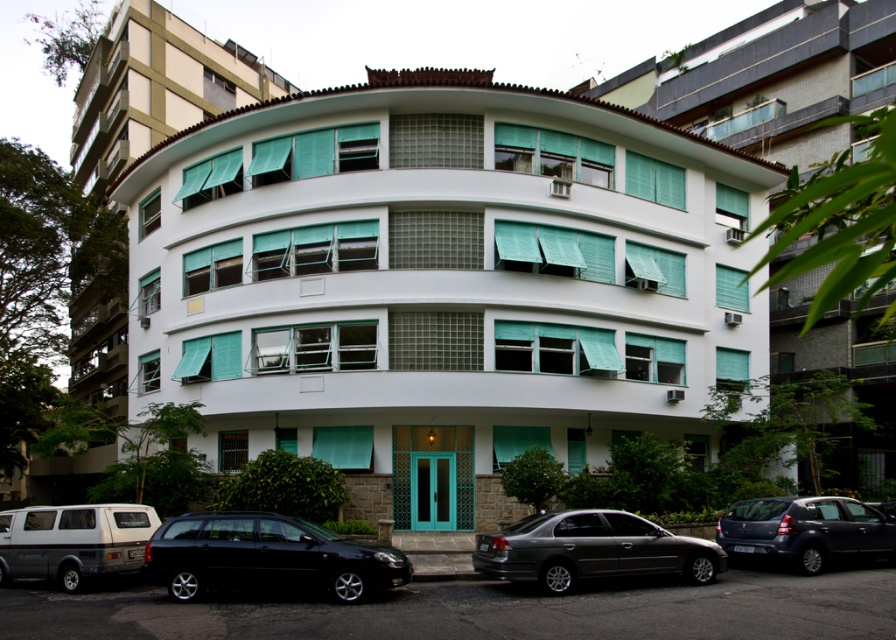
Question: Does white matte van at lower left have a smaller size compared to dark gray metallic car at lower right?

Choices:
 (A) no
 (B) yes

Answer: (B)

Question: Does black matte station wagon at lower left have a lesser width compared to metallic gray sedan at center?

Choices:
 (A) yes
 (B) no

Answer: (A)

Question: Among these objects, which one is farthest from the camera?

Choices:
 (A) white matte van at lower left
 (B) metallic gray sedan at center

Answer: (A)

Question: Among these points, which one is farthest from the camera?

Choices:
 (A) (672, 552)
 (B) (767, 522)
 (C) (95, 547)
 (D) (303, 563)

Answer: (B)

Question: Does black matte station wagon at lower left lie behind white matte van at lower left?

Choices:
 (A) yes
 (B) no

Answer: (B)

Question: Among these points, which one is nearest to the camera?

Choices:
 (A) (582, 556)
 (B) (817, 506)

Answer: (A)